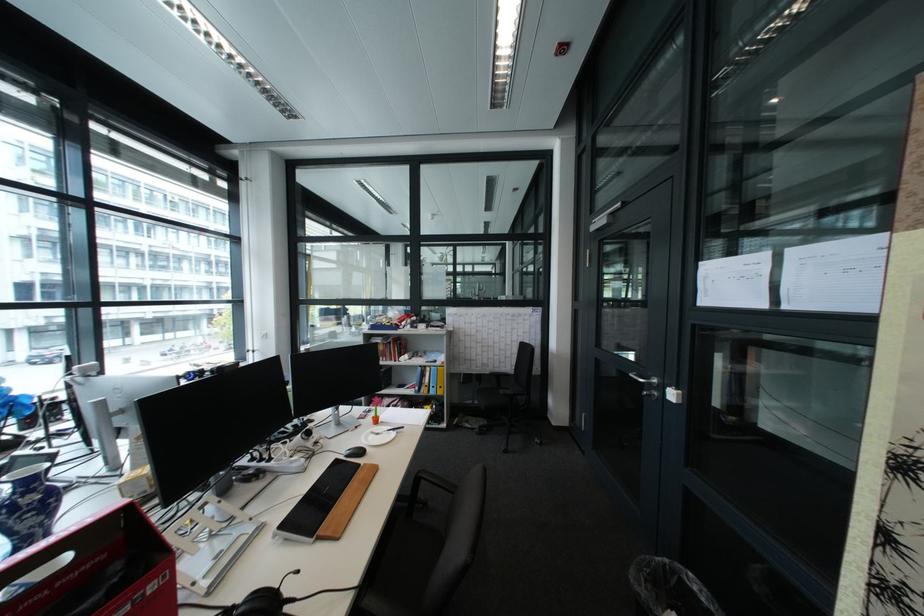
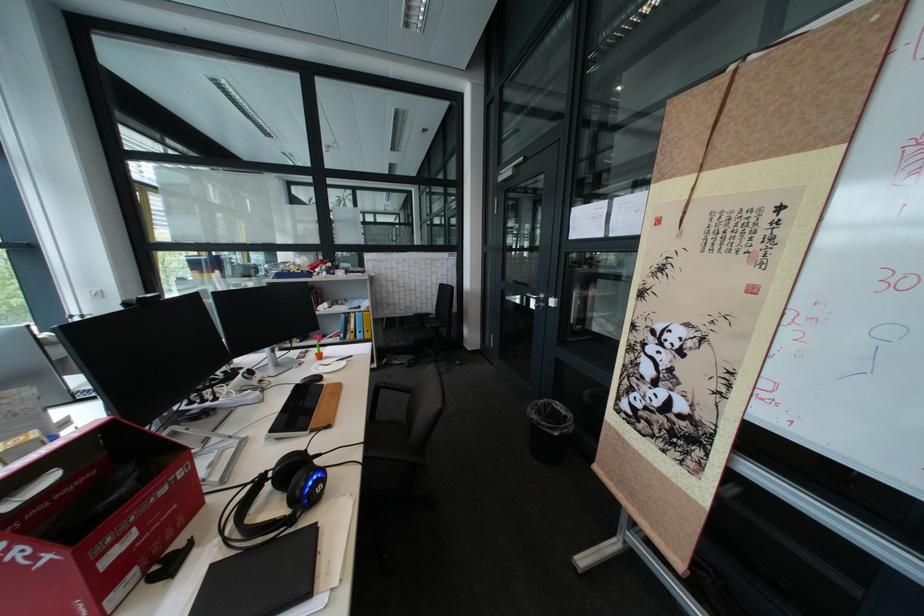
Locate, in the second image, the point that corresponds to pixel 370 428 in the first image.

(313, 365)